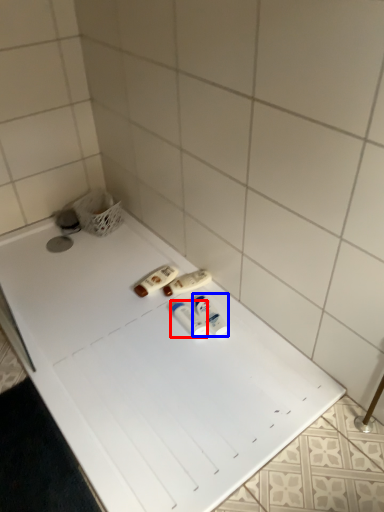
Question: Which of the following is the farthest to the observer, toiletry (highlighted by a red box) or toiletry (highlighted by a blue box)?

Choices:
 (A) toiletry
 (B) toiletry

Answer: (B)